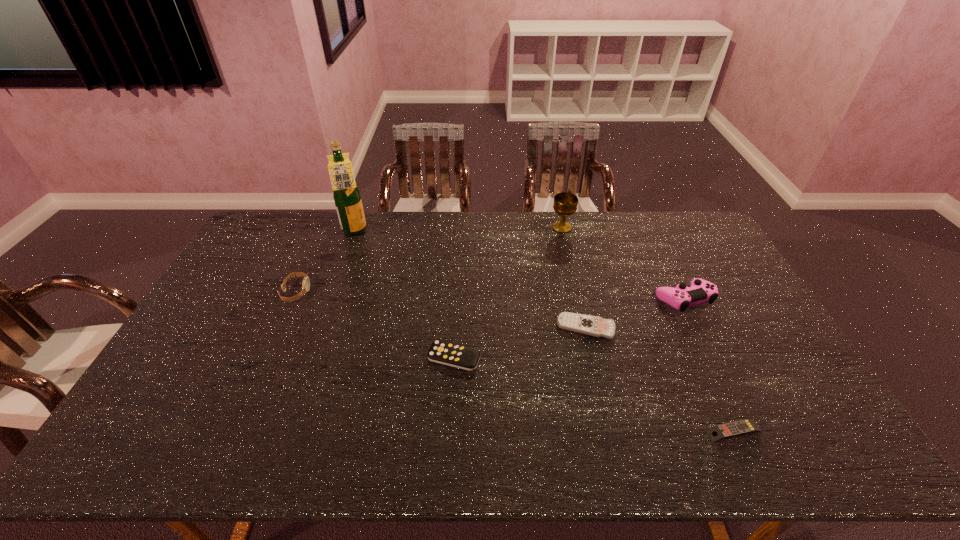
Identify the location of object present at the near edge. The image size is (960, 540). (746, 426).

Find the location of a particular element. The image size is (960, 540). object at the right edge is located at coordinates (700, 291).

What are the coordinates of `free space at the far edge of the desktop` in the screenshot? It's located at pyautogui.click(x=514, y=231).

Identify the location of blank space at the near edge. (300, 446).

The width and height of the screenshot is (960, 540). In order to click on vacant space at the left edge of the desktop in this screenshot , I will do `click(187, 356)`.

What are the coordinates of `blank area at the right edge` in the screenshot? It's located at pyautogui.click(x=687, y=253).

In the image, there is a desktop. Identify the location of free space at the far right corner. (706, 240).

Where is `vacant area that lies between the second remote control from right to left and the tallest remote control`? The image size is (960, 540). vacant area that lies between the second remote control from right to left and the tallest remote control is located at coordinates (520, 342).

You are a GUI agent. You are given a task and a screenshot of the screen. Output one action in this format:
    pyautogui.click(x=<x>, y=<y>)
    Task: Click on the free space between the liquor and the second tallest object
    The image size is (960, 540).
    Given the screenshot: What is the action you would take?
    pyautogui.click(x=459, y=230)

Locate an element on the screen. vacant region between the watch and the rightmost remote control is located at coordinates (515, 362).